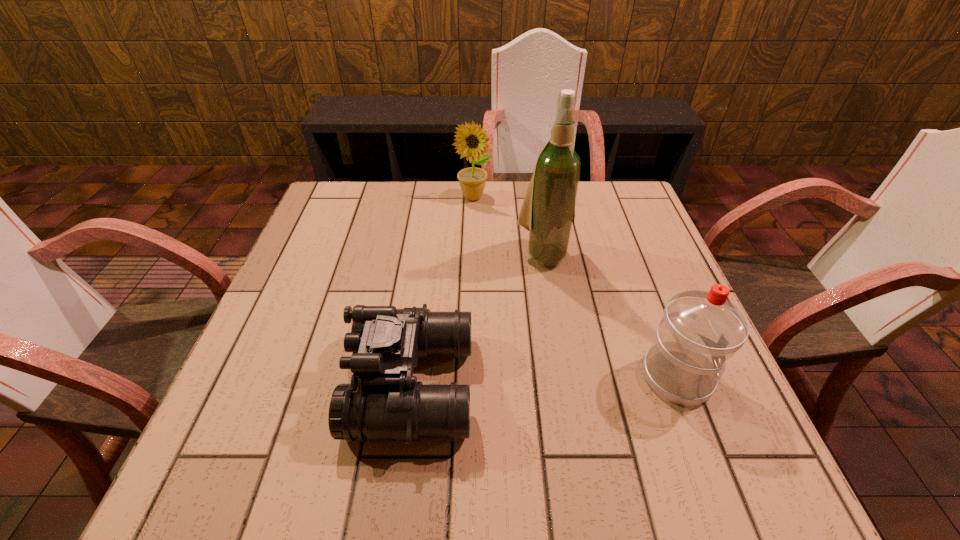
At what (x,y) coordinates should I click in order to perform the action: click on free spot on the desktop that is between the binoculars and the water bottle and is positioned on the face of the farthest object. Please return your answer as a coordinate pair (x, y). The image size is (960, 540). Looking at the image, I should click on (581, 380).

This screenshot has width=960, height=540. I want to click on free space on the desktop that is between the shortest object and the rightmost object and is positioned on the front-facing side of the wine bottle, so click(581, 380).